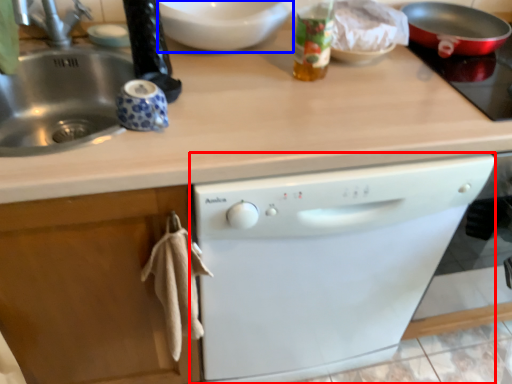
Question: Among these objects, which one is nearest to the camera, dishwasher (highlighted by a red box) or mixing bowl (highlighted by a blue box)?

Choices:
 (A) dishwasher
 (B) mixing bowl

Answer: (A)